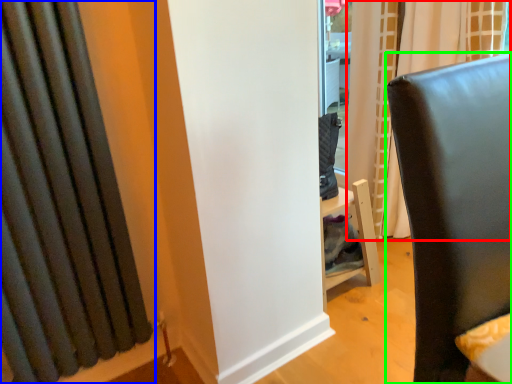
Question: Which object is positioned farthest from curtain (highlighted by a red box)? Select from curtain (highlighted by a blue box) and furniture (highlighted by a green box).

Choices:
 (A) curtain
 (B) furniture

Answer: (A)